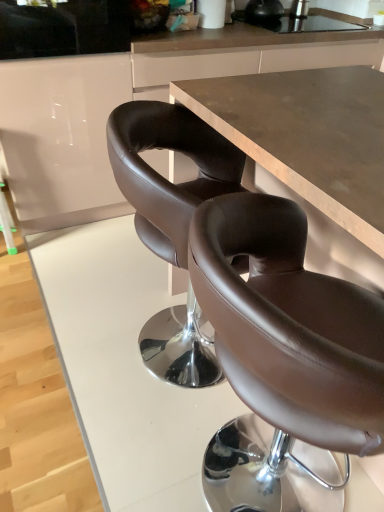
Question: From a real-world perspective, is brown leather chair at center on white glossy cabinet at upper left?

Choices:
 (A) no
 (B) yes

Answer: (A)

Question: Can you confirm if brown leather chair at center is smaller than white glossy cabinet at upper left?

Choices:
 (A) no
 (B) yes

Answer: (B)

Question: Can you confirm if brown leather chair at center is shorter than white glossy cabinet at upper left?

Choices:
 (A) yes
 (B) no

Answer: (A)

Question: Is white glossy cabinet at upper left a part of brown leather chair at center?

Choices:
 (A) no
 (B) yes

Answer: (A)

Question: Is brown leather chair at center directly adjacent to white glossy cabinet at upper left?

Choices:
 (A) no
 (B) yes

Answer: (A)

Question: From a real-world perspective, is brown leather chair at center physically below white glossy cabinet at upper left?

Choices:
 (A) no
 (B) yes

Answer: (B)

Question: Considering the relative sizes of brown leather bar stool at left and brown matte counter at center in the image provided, is brown leather bar stool at left wider than brown matte counter at center?

Choices:
 (A) yes
 (B) no

Answer: (A)

Question: Considering the relative sizes of brown leather bar stool at left and brown matte counter at center in the image provided, is brown leather bar stool at left smaller than brown matte counter at center?

Choices:
 (A) yes
 (B) no

Answer: (A)

Question: Can you confirm if brown leather bar stool at left is thinner than brown matte counter at center?

Choices:
 (A) yes
 (B) no

Answer: (B)

Question: Does brown leather bar stool at left have a greater height compared to brown matte counter at center?

Choices:
 (A) yes
 (B) no

Answer: (B)

Question: Does brown leather bar stool at left appear on the left side of brown matte counter at center?

Choices:
 (A) no
 (B) yes

Answer: (B)

Question: From the image's perspective, is brown leather bar stool at left on top of brown matte counter at center?

Choices:
 (A) yes
 (B) no

Answer: (B)

Question: Does brown leather bar stool at left have a lesser height compared to brown leather chair at center?

Choices:
 (A) no
 (B) yes

Answer: (B)